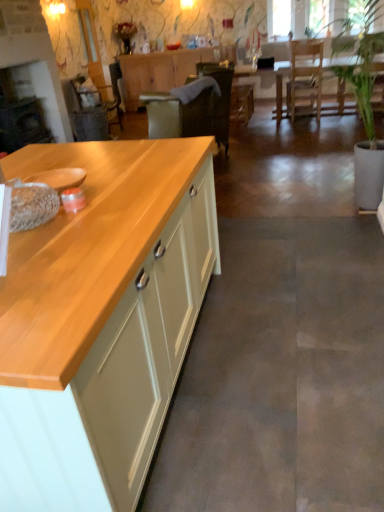
Question: From the image's perspective, relative to wooden table at center, is light wood/texture cabinet at left, the second cabinetry from the top, above or below?

Choices:
 (A) above
 (B) below

Answer: (B)

Question: In terms of height, does light wood/texture cabinet at left, the first cabinetry from the front, look taller or shorter compared to wooden table at center?

Choices:
 (A) tall
 (B) short

Answer: (A)

Question: Which of these objects is positioned closest to the light wood/texture cabinet at left, the first cabinetry from the front?

Choices:
 (A) matte wood cabinet at center, placed as the 2th cabinetry when sorted from front to back
 (B) wooden armchair at left
 (C) wooden table at center
 (D) green leafy plant at right

Answer: (D)

Question: Considering the real-world distances, which object is closest to the matte wood cabinet at center, which ranks as the first cabinetry in back-to-front order?

Choices:
 (A) light wood/texture cabinet at left, the second cabinetry from the top
 (B) wooden armchair at left
 (C) wooden table at center
 (D) green leafy plant at right

Answer: (B)